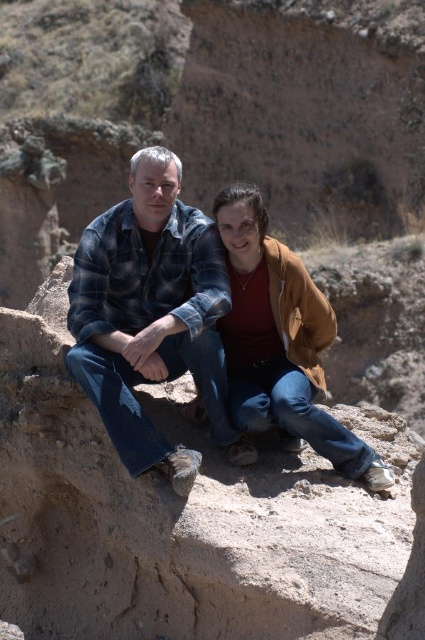
Measure the distance between plaid flannel shirt at center and brown suede jacket at center.

The distance of plaid flannel shirt at center from brown suede jacket at center is 2.76 meters.

Does plaid flannel shirt at center have a lesser width compared to brown suede jacket at center?

Incorrect, plaid flannel shirt at center's width is not less than brown suede jacket at center's.

The image size is (425, 640). I want to click on plaid flannel shirt at center, so click(x=152, y=316).

Locate an element on the screen. plaid flannel shirt at center is located at coordinates (152, 316).